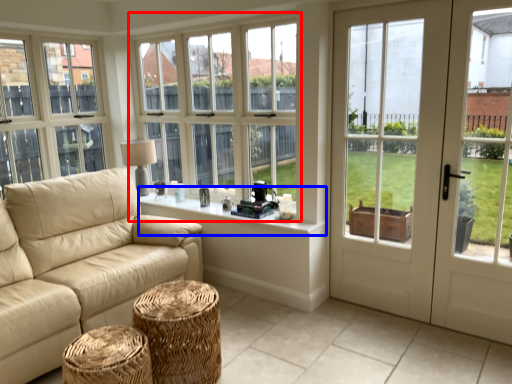
Question: Among these objects, which one is nearest to the camera, window (highlighted by a red box) or window sill (highlighted by a blue box)?

Choices:
 (A) window
 (B) window sill

Answer: (B)